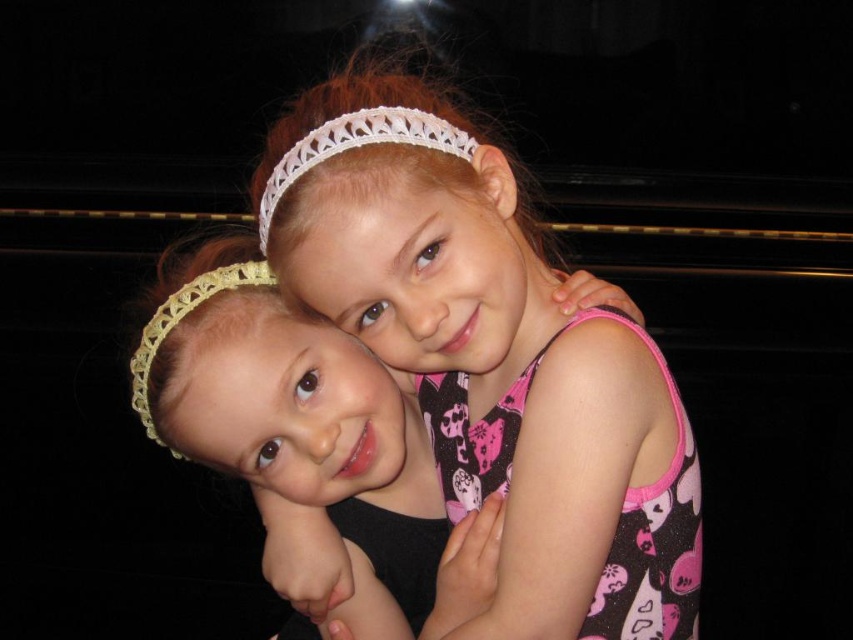
Question: Which is nearer to the yellow crochet headband at left?

Choices:
 (A) pink fabric dress at center
 (B) white lace headband at upper center

Answer: (B)

Question: Which of the following is the closest to the observer?

Choices:
 (A) pyautogui.click(x=404, y=138)
 (B) pyautogui.click(x=444, y=353)

Answer: (A)

Question: Estimate the real-world distances between objects in this image. Which object is closer to the white lace headband at upper center?

Choices:
 (A) pink fabric dress at center
 (B) yellow crochet headband at left

Answer: (A)

Question: Does pink fabric dress at center have a smaller size compared to white lace headband at upper center?

Choices:
 (A) no
 (B) yes

Answer: (A)

Question: Does pink fabric dress at center appear over yellow crochet headband at left?

Choices:
 (A) yes
 (B) no

Answer: (B)

Question: Is white lace headband at upper center positioned before yellow crochet headband at left?

Choices:
 (A) no
 (B) yes

Answer: (B)